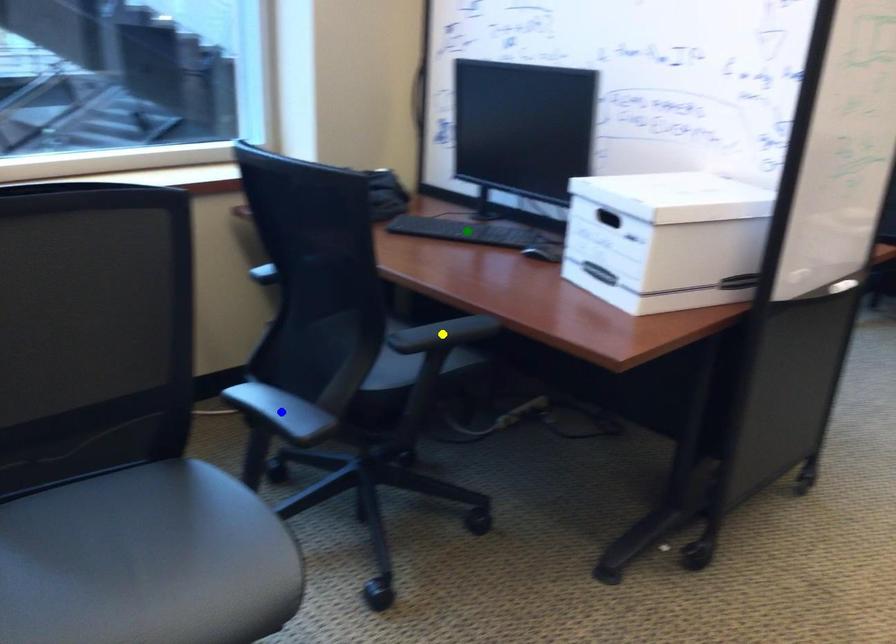
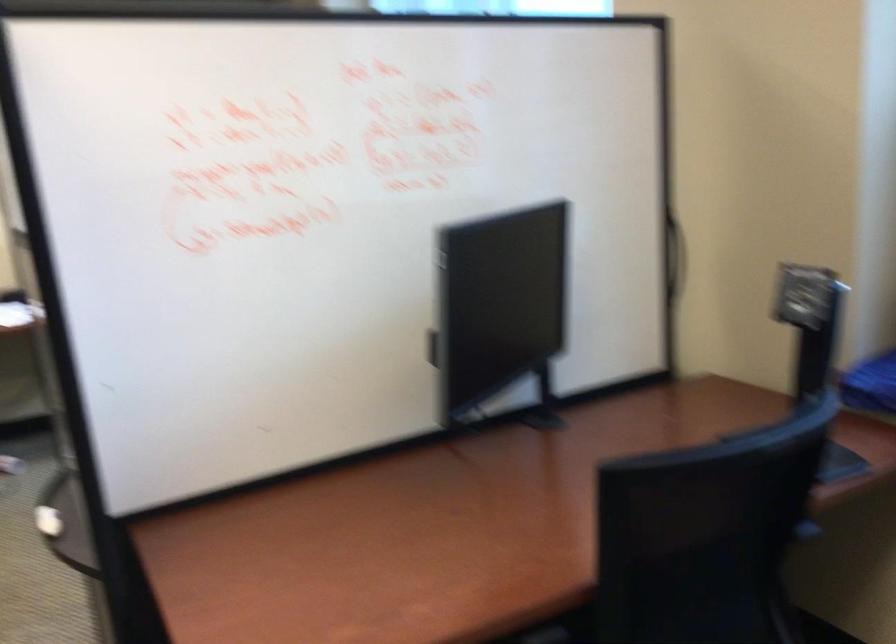
I am providing you with two images of the same scene from different viewpoints. Three points are marked in image1. Which point corresponds to a part or object that is occluded in image2?In image1, three points are marked. Which of them correspond to a part or object that is occluded in image2?Among the three points shown in image1, which one corresponds to a part or object that is no longer visible due to occlusion in image2?

green point, blue point, yellow point cannot be seen in image2.